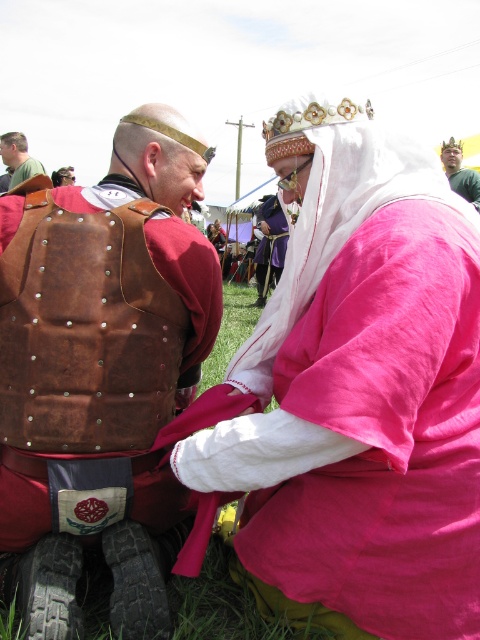
You are a photographer at the medieval event and want to capture both the pink cotton robe at center and the brown leather vest at center in a single frame. Your camera has a maximum focus range of 18 inches. Can you adjust your position so that both subjects are within the focus range?

The distance between the pink cotton robe at center and brown leather vest at center is 18.82 inches, which exceeds the camera focus range of 18 inches. Therefore, you cannot capture both subjects within the focus range without moving closer or adjusting the camera settings.

Based on the photo, you are a photographer at the medieval event. You want to take a photo focusing on the pink cotton robe at center and the green fabric headband at upper center. Which object will appear larger in the photo?

The pink cotton robe at center will appear larger in the photo because it is closer to the viewer than the green fabric headband at upper center. Objects closer to the camera generally appear larger in photographs.